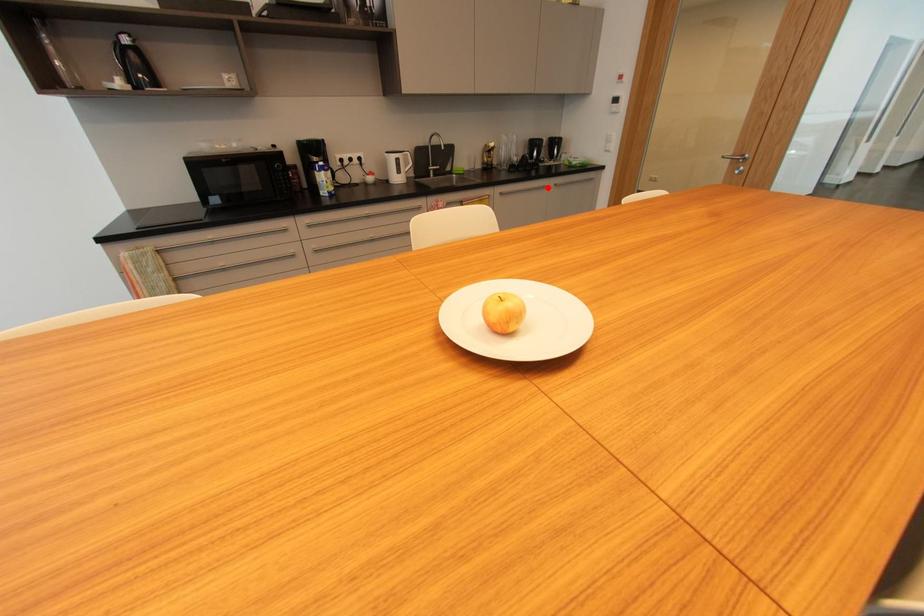
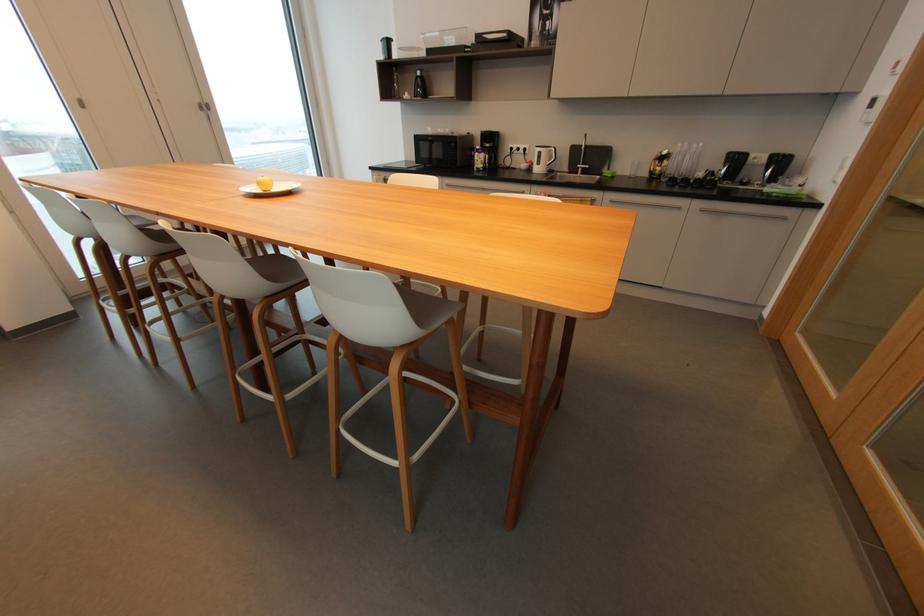
Question: I am providing you with two images of the same scene from different viewpoints. A red point is marked on the first image. Can you still see the location of the red point in image 2?

Choices:
 (A) Yes
 (B) No

Answer: (A)